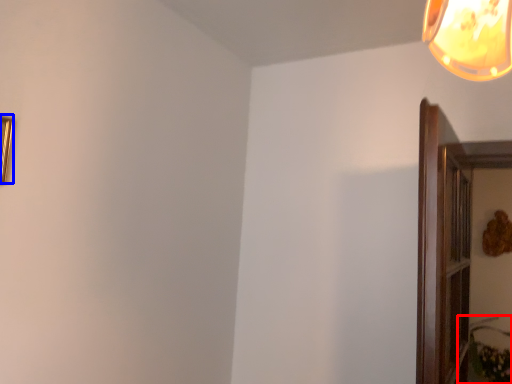
Question: Which object is closer to the camera taking this photo, plant (highlighted by a red box) or picture frame (highlighted by a blue box)?

Choices:
 (A) plant
 (B) picture frame

Answer: (B)